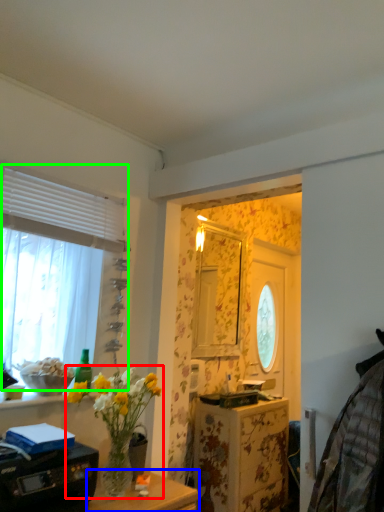
Question: Which is nearer to the houseplant (highlighted by a red box)? table (highlighted by a blue box) or window (highlighted by a green box).

Choices:
 (A) table
 (B) window

Answer: (A)